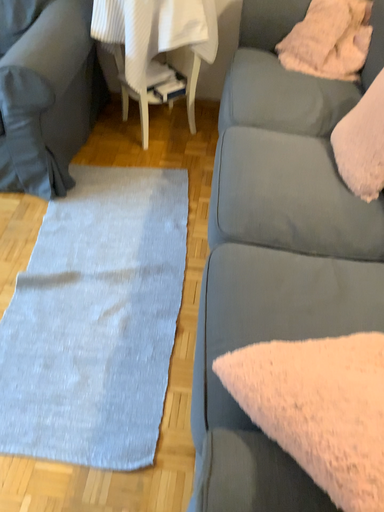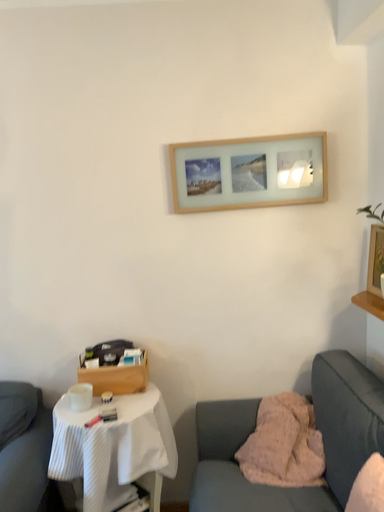
Question: Which way did the camera rotate in the video?

Choices:
 (A) rotated downward
 (B) rotated upward

Answer: (B)